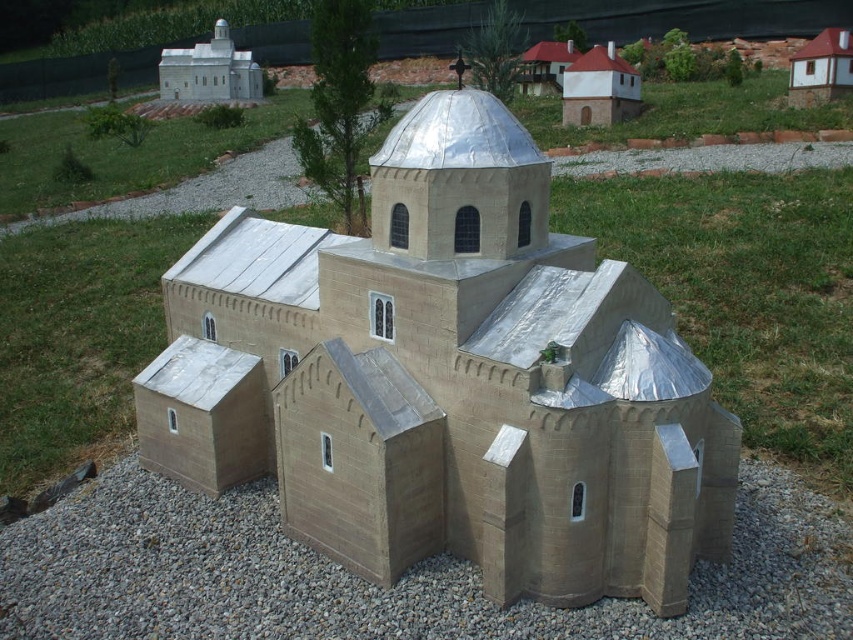
From the picture: You are a drone operator tasked with capturing aerial footage of the matte silver church at center. The drone must maintain a minimum altitude of 10 meters to avoid detection. Given the church is at coordinates point 0.594, 0.532, can you confirm if the drone can hover directly above it at the required altitude without obstruction?

The matte silver church at center is located at point (x=453, y=380). Since the scene describes the church being surrounded by a gravel area and grassy field with other miniature buildings, the drone can likely hover directly above it at 10 meters as there are no tall structures obstructing the airspace at that altitude according to the provided scene description.

You are standing at the center of the church model and looking towards the lower center. What material do you see at the point marked by coordinates point (375, 586)?

The point (375, 586) marks gray gravel at lower center.